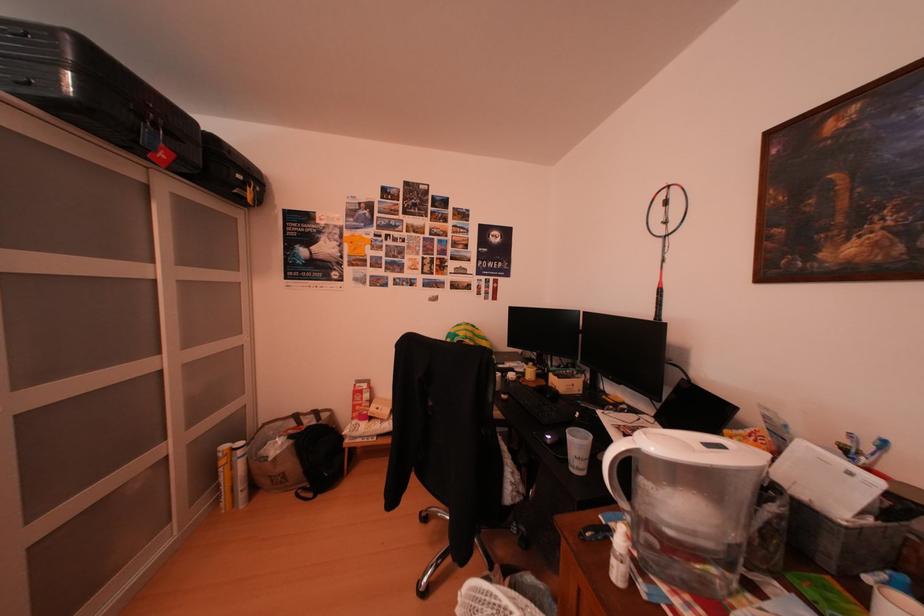
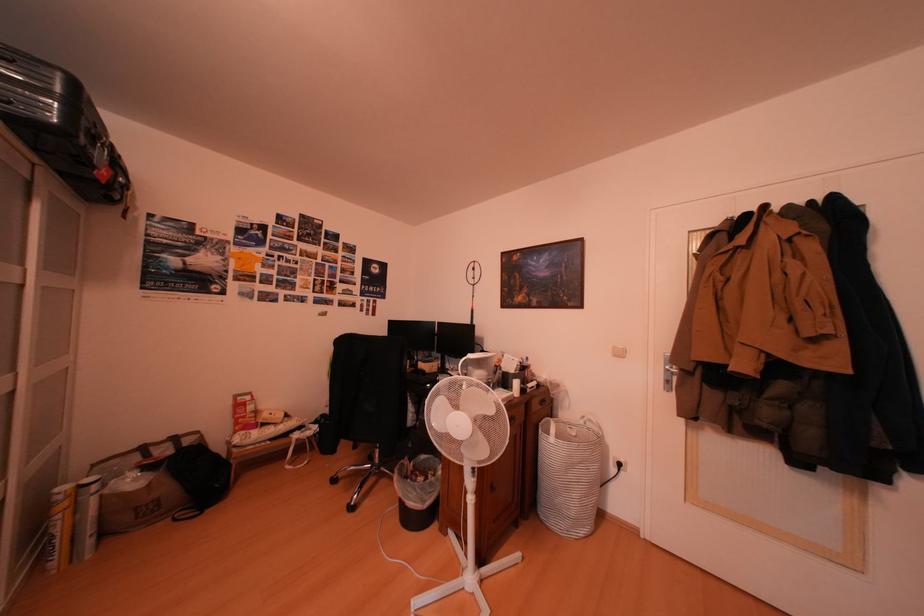
Question: How did the camera likely rotate?

Choices:
 (A) Left
 (B) Right
 (C) Up
 (D) Down

Answer: (B)